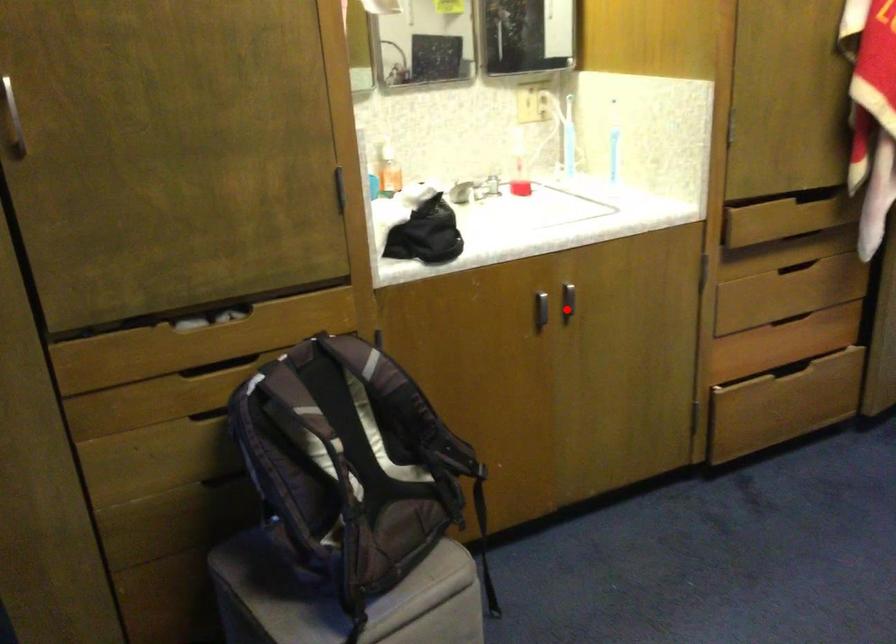
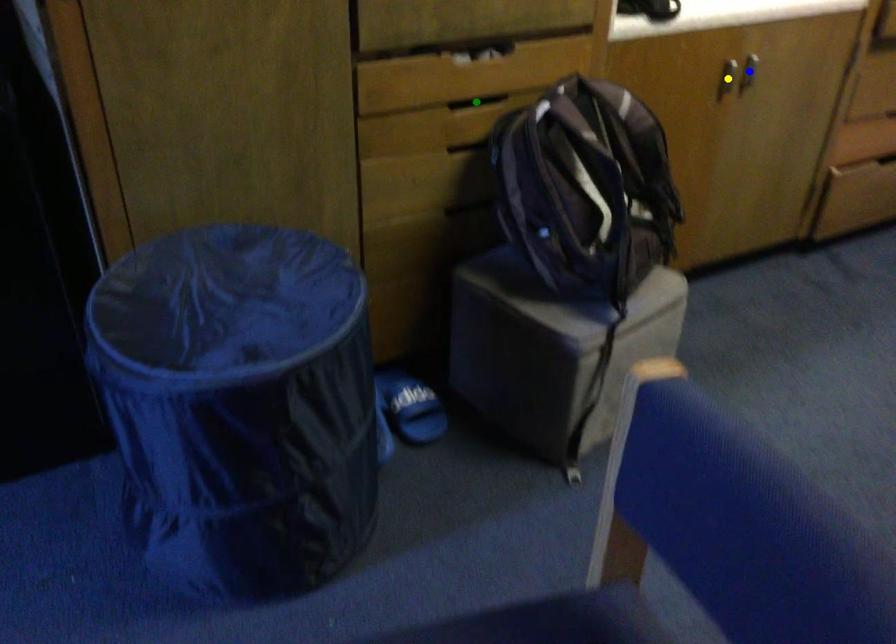
Question: I am providing you with two images of the same scene from different viewpoints. A red point is marked on the first image. You are given multiple points on the second image. Which point in image 2 represents the same 3d spot as the red point in image 1?

Choices:
 (A) green point
 (B) blue point
 (C) yellow point

Answer: (B)